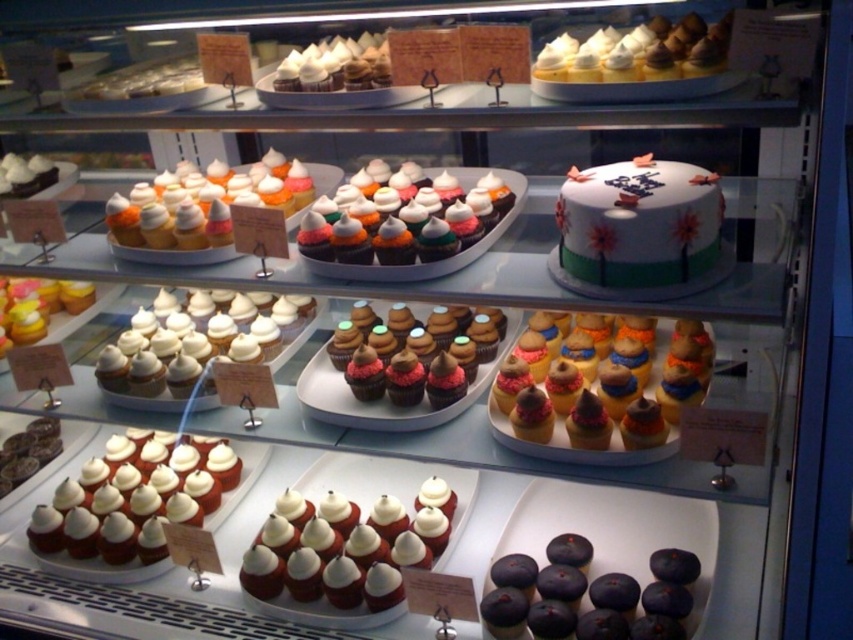
Question: Among these objects, which one is farthest from the camera?

Choices:
 (A) glazed chocolate cupcake at center
 (B) dark purple cupcake at lower right

Answer: (A)

Question: Which is nearer to the white glossy cupcake at center left?

Choices:
 (A) white frosted cupcake at lower left
 (B) glazed chocolate cupcake at center
 (C) matte white cake at upper center

Answer: (A)

Question: Is white fondant cake at upper right wider than white meringue-topped cupcakes at upper center?

Choices:
 (A) yes
 (B) no

Answer: (A)

Question: Can you confirm if white fondant cake at upper right is positioned to the left of matte white cupcake at left?

Choices:
 (A) no
 (B) yes

Answer: (A)

Question: Considering the real-world distances, which object is closest to the white glossy cupcake at upper center?

Choices:
 (A) matte white cupcake at left
 (B) dark purple cupcake at lower right
 (C) chocolate frosted cupcake at center
 (D) matte chocolate cupcake at center

Answer: (D)

Question: In this image, where is white fondant cake at upper right located relative to white glossy cupcake at center left?

Choices:
 (A) right
 (B) left

Answer: (A)